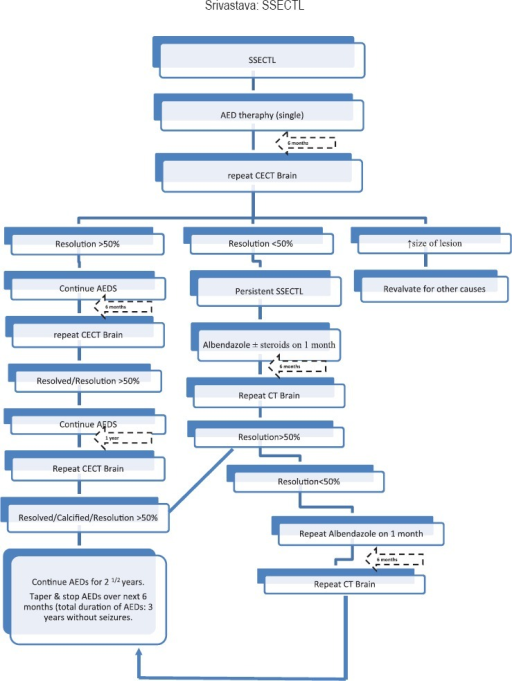
Locate an element on the screen. left column is located at coordinates (94, 218), (94, 426), (93, 528), (99, 568).